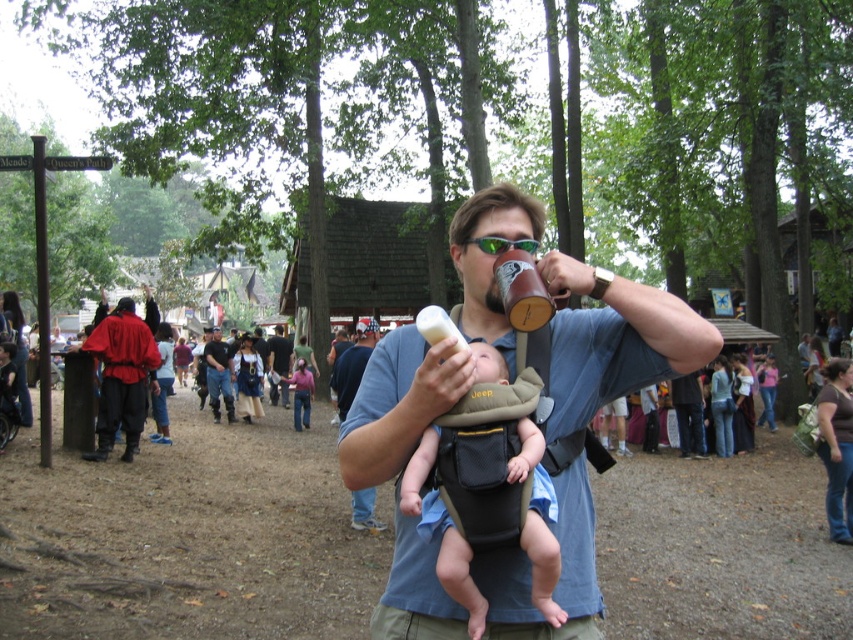
Question: Is matte brown leather mug at center further to the viewer compared to blue denim shirt at center?

Choices:
 (A) yes
 (B) no

Answer: (B)

Question: Is matte brown leather mug at center wider than soft beige carrier at center?

Choices:
 (A) yes
 (B) no

Answer: (A)

Question: Which point is closer to the camera?

Choices:
 (A) dark brown leather jacket at center
 (B) red leather jacket at center

Answer: (B)

Question: Is matte brown leather mug at center to the right of blue denim shirt at center from the viewer's perspective?

Choices:
 (A) no
 (B) yes

Answer: (B)

Question: Which point is farther from the camera taking this photo?

Choices:
 (A) (209, 381)
 (B) (538, 596)
 (C) (337, 410)

Answer: (A)

Question: Which point appears closest to the camera in this image?

Choices:
 (A) (120, 346)
 (B) (456, 392)
 (C) (488, 401)

Answer: (B)